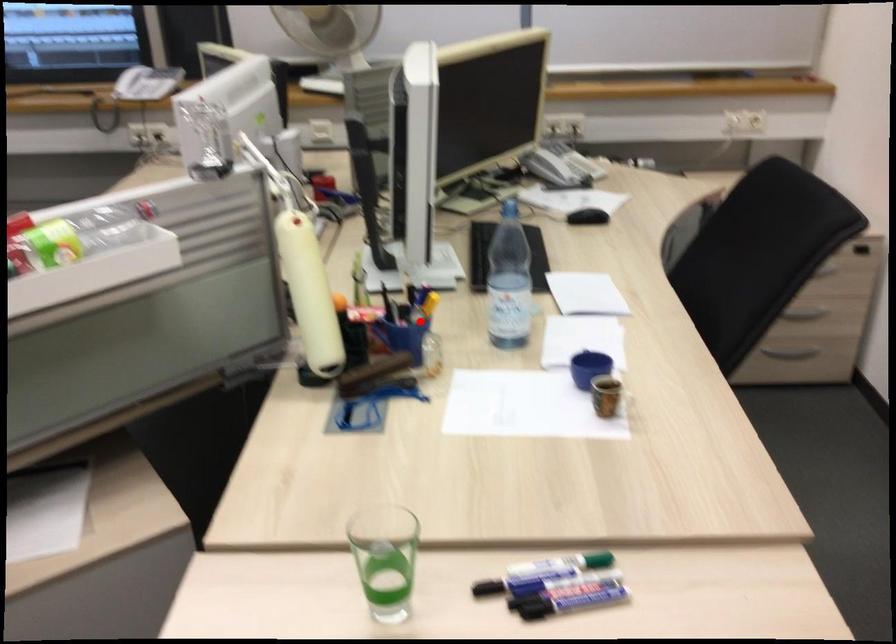
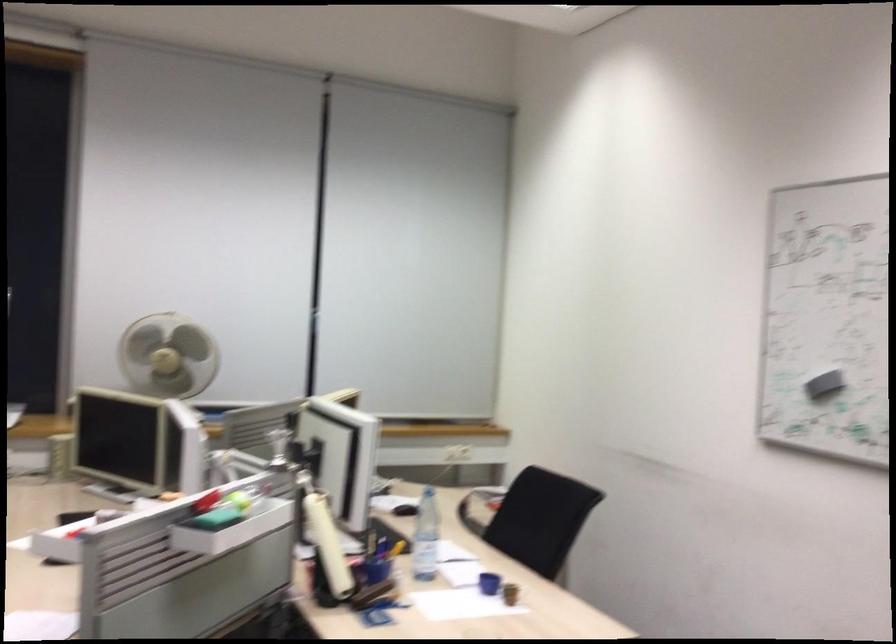
The point at the highlighted location is marked in the first image. Where is the corresponding point in the second image?

(377, 563)